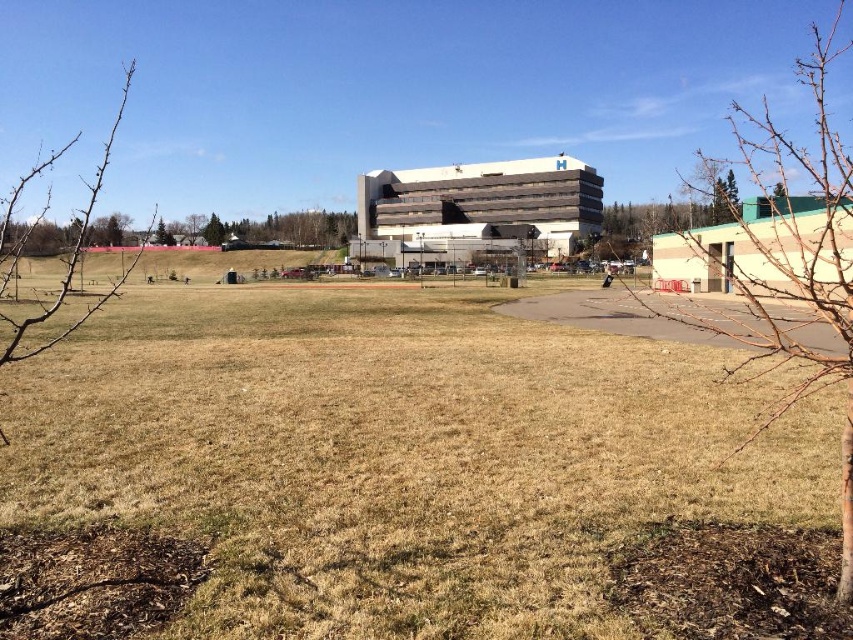
Can you confirm if bare branches at lower right is positioned below bare branches at upper left?

No, bare branches at lower right is not below bare branches at upper left.

Is bare branches at lower right above bare branches at upper left?

Correct, bare branches at lower right is located above bare branches at upper left.

Where is `bare branches at lower right`? bare branches at lower right is located at coordinates (799, 260).

Which of these two, brown dry grass at center or bare branches at lower right, stands taller?

Standing taller between the two is bare branches at lower right.

Which is behind, point (222, 337) or point (827, 189)?

Positioned behind is point (222, 337).

The height and width of the screenshot is (640, 853). I want to click on brown dry grass at center, so click(383, 461).

Who is lower down, bare branches at lower right or white concrete building at center?

white concrete building at center is lower down.

Is the position of bare branches at lower right more distant than that of white concrete building at center?

No.

Identify the location of bare branches at lower right. (799, 260).